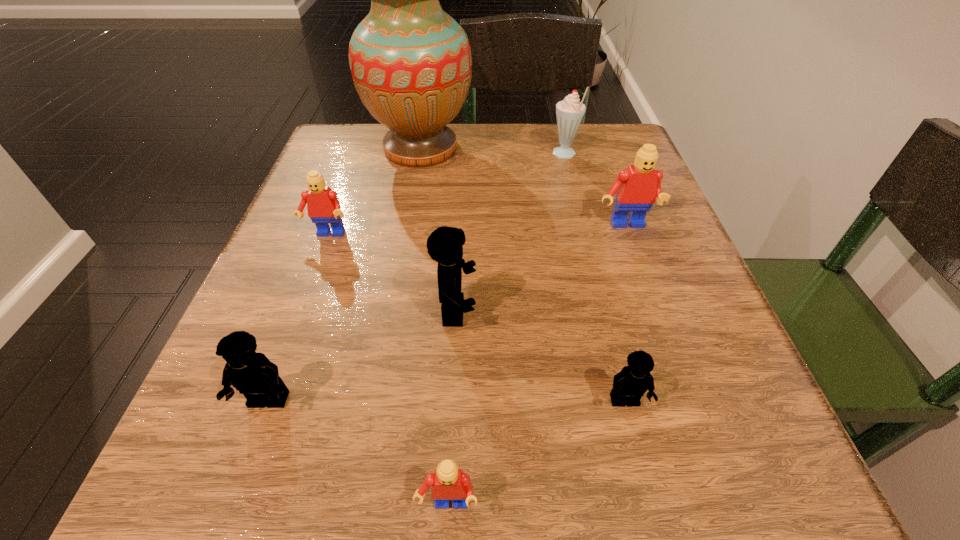
The height and width of the screenshot is (540, 960). I want to click on free space between the second red Lego from left to right and the tallest object, so click(434, 327).

Locate an element on the screen. This screenshot has height=540, width=960. vacant region between the white milkshake and the rightmost yellow Lego is located at coordinates (594, 278).

Where is `object that stands as the seventh closest to the white milkshake`? object that stands as the seventh closest to the white milkshake is located at coordinates (448, 482).

I want to click on object identified as the fifth closest to the second biggest red Lego, so click(569, 112).

Point out which Lego is positioned as the fourth nearest to the second yellow Lego from left to right. Please provide its 2D coordinates. Your answer should be formatted as a tuple, i.e. [(x, y)], where the tuple contains the x and y coordinates of a point satisfying the conditions above.

[(448, 482)]

The image size is (960, 540). I want to click on Lego that is the fifth closest to the second smallest yellow Lego, so click(636, 188).

Identify the location of yellow Lego that is the closest to the rightmost yellow Lego. The height and width of the screenshot is (540, 960). (445, 244).

You are a GUI agent. You are given a task and a screenshot of the screen. Output one action in this format:
    pyautogui.click(x=<x>, y=<y>)
    Task: Click on the yellow Lego that is the third closest to the second biggest red Lego
    
    Given the screenshot: What is the action you would take?
    point(630,384)

Choose which red Lego is the second nearest neighbor to the farthest yellow Lego. Please provide its 2D coordinates. Your answer should be formatted as a tuple, i.e. [(x, y)], where the tuple contains the x and y coordinates of a point satisfying the conditions above.

[(448, 482)]

Select which red Lego is the closest to the fourth nearest object. Please provide its 2D coordinates. Your answer should be formatted as a tuple, i.e. [(x, y)], where the tuple contains the x and y coordinates of a point satisfying the conditions above.

[(323, 206)]